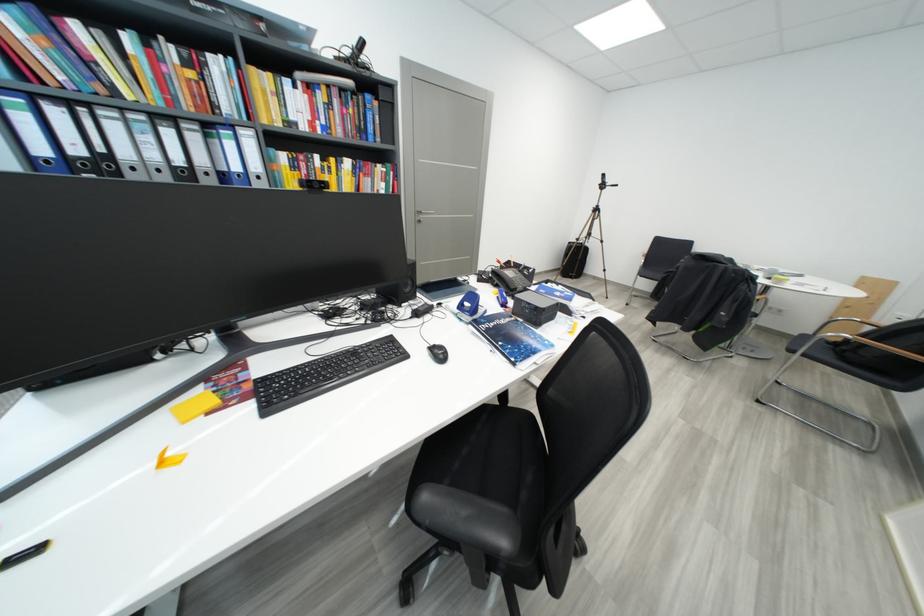
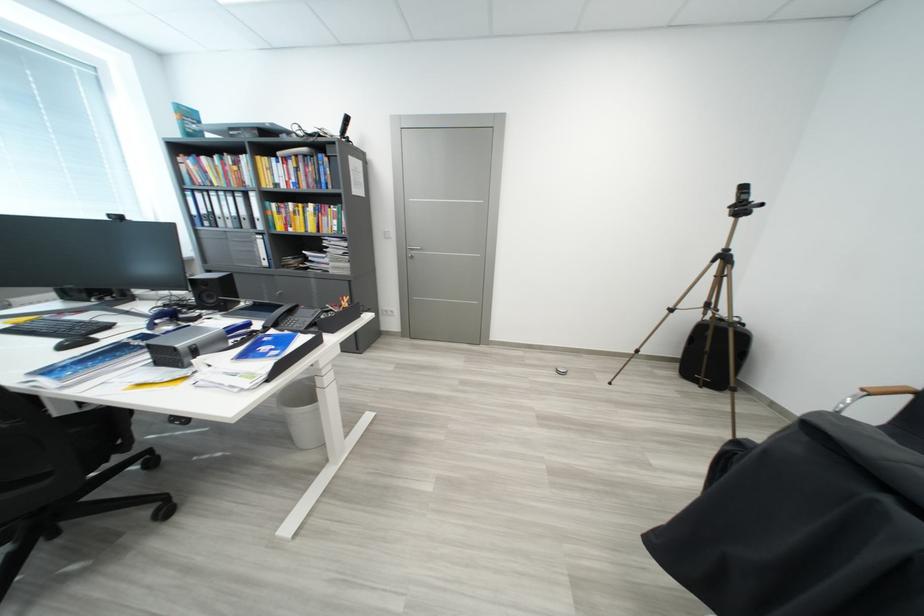
In the second image, find the point that corresponds to the point at 567,280 in the first image.

(684, 377)